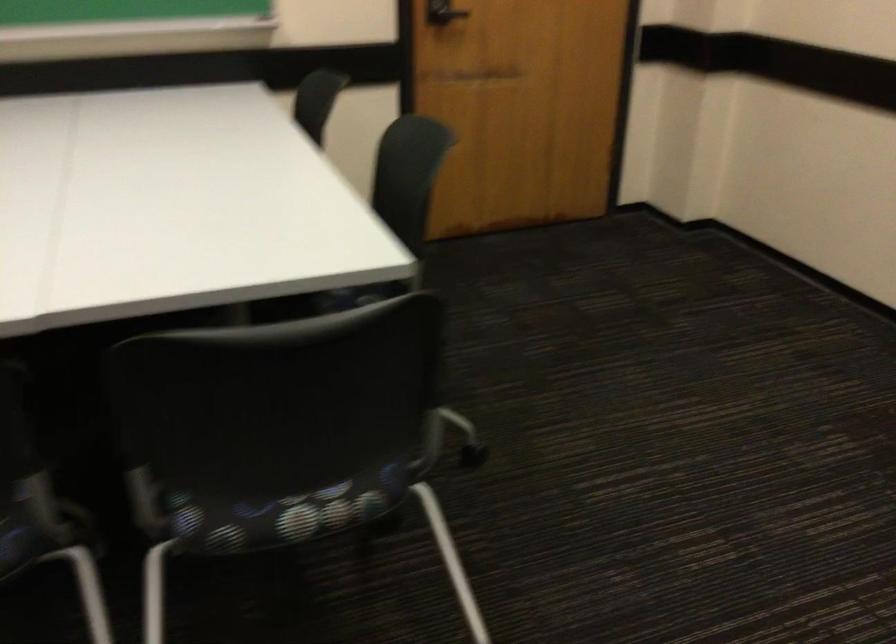
What do you see at coordinates (443, 13) in the screenshot? This screenshot has height=644, width=896. I see `the black door handle` at bounding box center [443, 13].